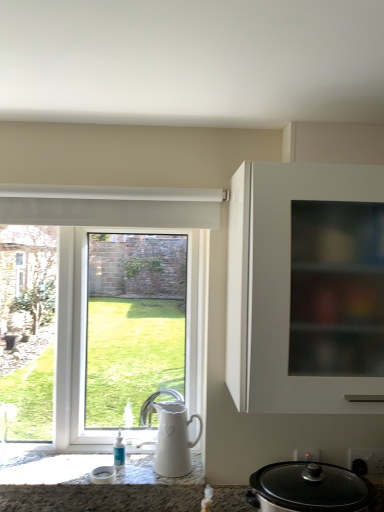
Question: Does white ceramic jug at lower center have a lesser width compared to black glass slow cooker at lower right?

Choices:
 (A) no
 (B) yes

Answer: (B)

Question: Are white ceramic jug at lower center and black glass slow cooker at lower right making contact?

Choices:
 (A) no
 (B) yes

Answer: (A)

Question: From a real-world perspective, is white ceramic jug at lower center on black glass slow cooker at lower right?

Choices:
 (A) yes
 (B) no

Answer: (A)

Question: Is white ceramic jug at lower center further to camera compared to black glass slow cooker at lower right?

Choices:
 (A) yes
 (B) no

Answer: (A)

Question: Is black glass slow cooker at lower right a part of white ceramic jug at lower center?

Choices:
 (A) no
 (B) yes

Answer: (A)

Question: Is white glossy window at left in front of or behind white ceramic jug at lower center in the image?

Choices:
 (A) front
 (B) behind

Answer: (B)

Question: Do you think white glossy window at left is within white ceramic jug at lower center, or outside of it?

Choices:
 (A) outside
 (B) inside

Answer: (A)

Question: From the image's perspective, relative to white ceramic jug at lower center, is white glossy window at left above or below?

Choices:
 (A) below
 (B) above

Answer: (B)

Question: In the image, is white glossy window at left on the left side or the right side of white ceramic jug at lower center?

Choices:
 (A) left
 (B) right

Answer: (A)

Question: Is black glass slow cooker at lower right spatially inside white matte cabinet at right, or outside of it?

Choices:
 (A) inside
 (B) outside

Answer: (B)

Question: Based on their sizes in the image, would you say black glass slow cooker at lower right is bigger or smaller than white matte cabinet at right?

Choices:
 (A) big
 (B) small

Answer: (B)

Question: Looking at their shapes, would you say black glass slow cooker at lower right is wider or thinner than white matte cabinet at right?

Choices:
 (A) thin
 (B) wide

Answer: (A)

Question: Visually, is black glass slow cooker at lower right positioned to the left or to the right of white matte cabinet at right?

Choices:
 (A) right
 (B) left

Answer: (B)

Question: From their relative heights in the image, would you say white glossy window at left is taller or shorter than black glass slow cooker at lower right?

Choices:
 (A) short
 (B) tall

Answer: (B)

Question: From the image's perspective, is white glossy window at left located above or below black glass slow cooker at lower right?

Choices:
 (A) above
 (B) below

Answer: (A)